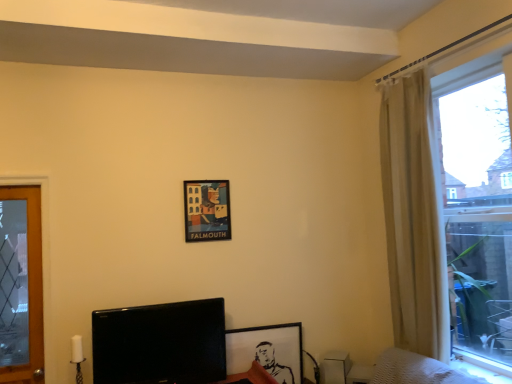
Question: Is translucent glass window at right to the left or to the right of black glossy tv at lower left in the image?

Choices:
 (A) left
 (B) right

Answer: (B)

Question: Relative to black glossy tv at lower left, is translucent glass window at right in front or behind?

Choices:
 (A) front
 (B) behind

Answer: (A)

Question: Which is farther from the black glossy tv at lower left?

Choices:
 (A) beige fabric curtain at right
 (B) translucent glass window at right
 (C) black matte picture frame at lower center, which is the second picture frame in left-to-right order
 (D) matte paper poster at center, the first picture frame in the left-to-right sequence

Answer: (B)

Question: Which object is positioned closest to the matte paper poster at center, the first picture frame in the left-to-right sequence?

Choices:
 (A) black matte picture frame at lower center, which appears as the second picture frame when viewed from the top
 (B) black glossy tv at lower left
 (C) beige fabric curtain at right
 (D) translucent glass window at right

Answer: (B)